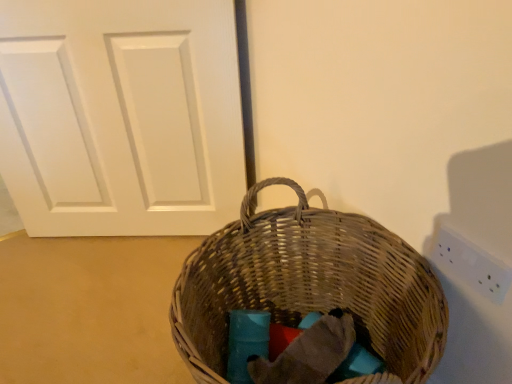
Where is `vacant area situated below white matte door at center (from a real-world perspective)`? The image size is (512, 384). vacant area situated below white matte door at center (from a real-world perspective) is located at coordinates (123, 232).